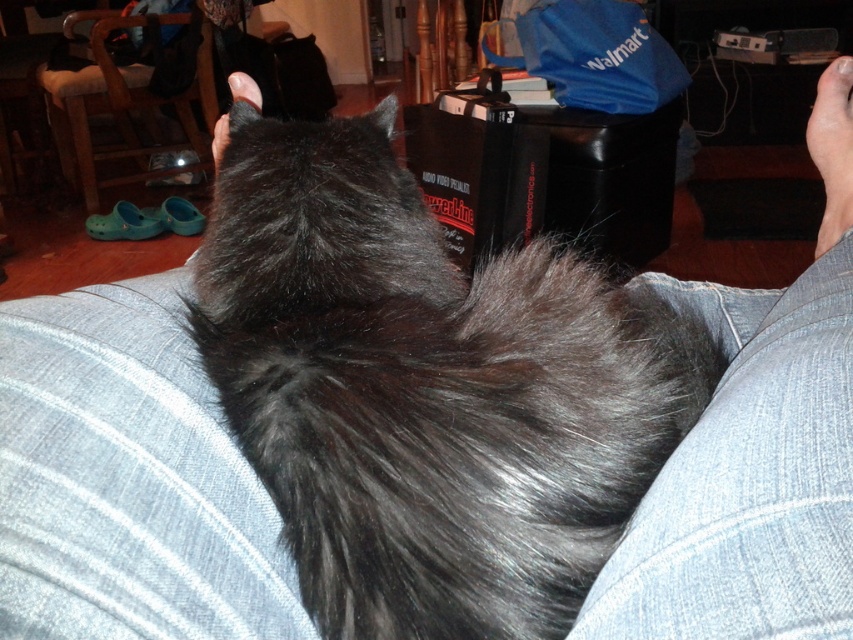
Can you confirm if fluffy black cat at center is positioned below fuzzy fur at center?

No.

Between point (613, 419) and point (123, 288), which one is positioned in front?

Point (613, 419)

At what (x,y) coordinates should I click in order to perform the action: click on fluffy black cat at center. Please return your answer as a coordinate pair (x, y). The width and height of the screenshot is (853, 640). Looking at the image, I should click on (427, 390).

Between fuzzy fur at center and denim at lower right, which one is positioned lower?

fuzzy fur at center is lower down.

Who is more distant from viewer, (253, 486) or (778, 612)?

Point (253, 486)

You are a GUI agent. You are given a task and a screenshot of the screen. Output one action in this format:
    pyautogui.click(x=<x>, y=<y>)
    Task: Click on the fuzzy fur at center
    
    Given the screenshot: What is the action you would take?
    pyautogui.click(x=126, y=477)

Which is behind, point (352, 586) or point (811, 500)?

Point (352, 586)

Does fluffy black cat at center have a greater width compared to denim at lower right?

Yes.

Where is `fluffy black cat at center`? This screenshot has height=640, width=853. fluffy black cat at center is located at coordinates (427, 390).

Identify the location of fluffy black cat at center. Image resolution: width=853 pixels, height=640 pixels. coord(427,390).